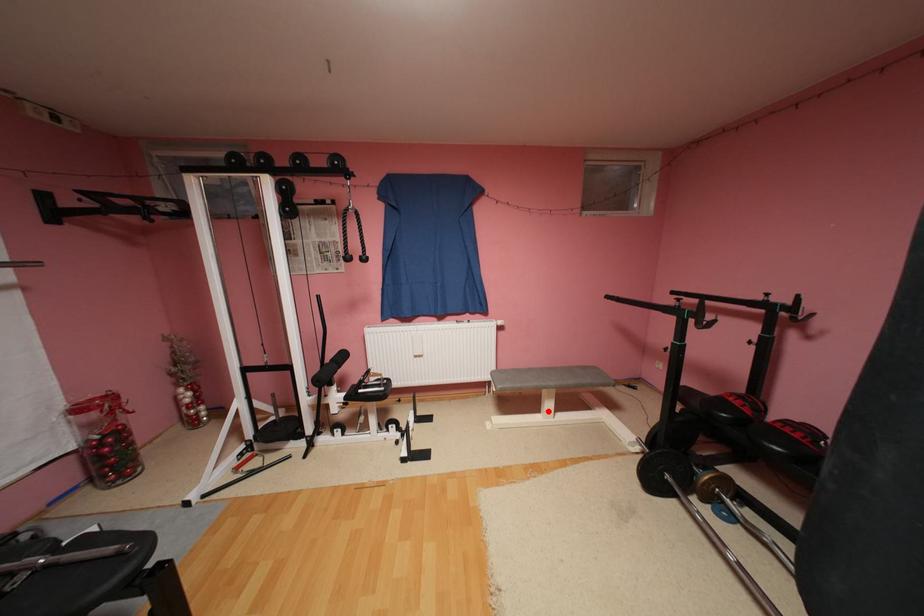
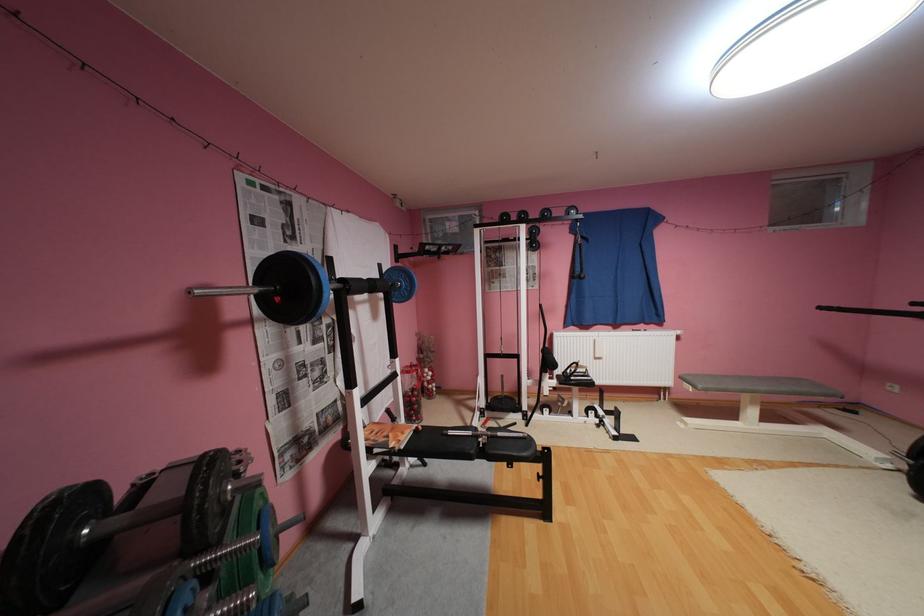
Where in the second image is the point corresponding to the highlighted location from the first image?

(746, 419)